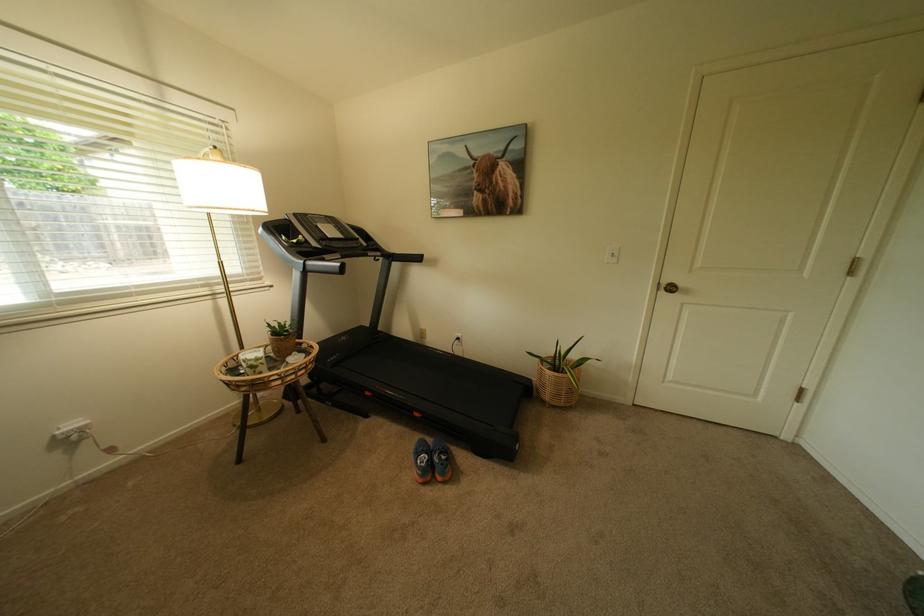
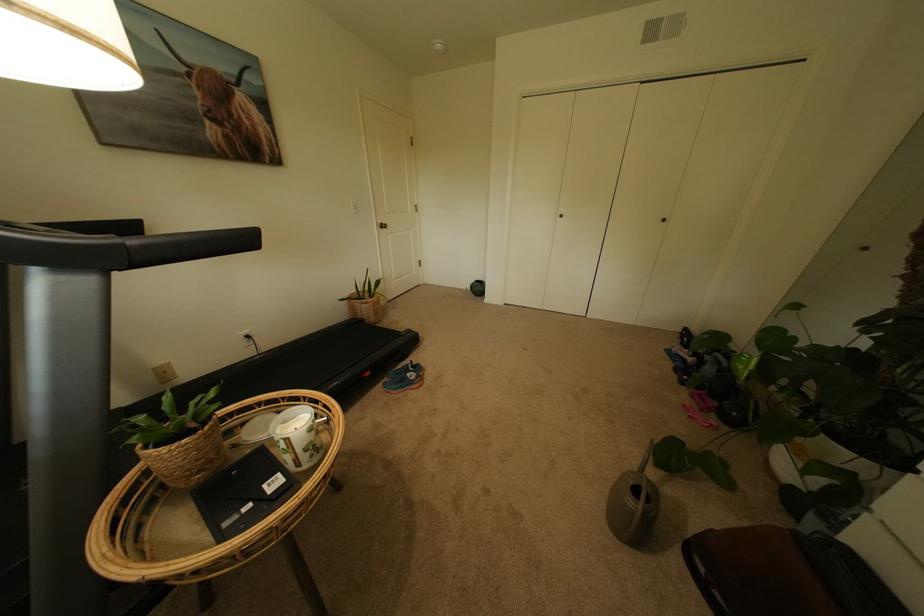
Where in the second image is the point corresponding to point 679,293 from the first image?

(394, 229)